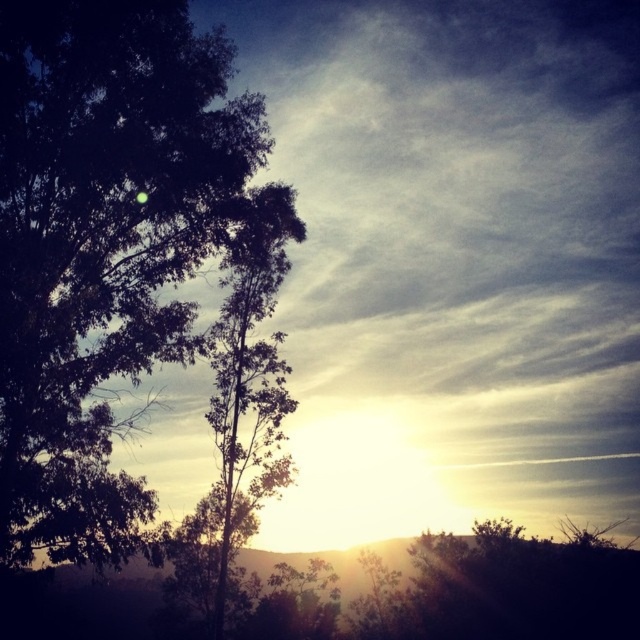
Question: Does dark green leafy tree at left have a larger size compared to green leafy tree at left?

Choices:
 (A) yes
 (B) no

Answer: (A)

Question: Can you confirm if dark green leafy tree at left is positioned above green leafy tree at left?

Choices:
 (A) no
 (B) yes

Answer: (B)

Question: Which point is closer to the camera?

Choices:
 (A) dark green leafy tree at left
 (B) green leafy tree at left

Answer: (A)

Question: Among these objects, which one is farthest from the camera?

Choices:
 (A) dark green leafy tree at left
 (B) green leafy tree at left

Answer: (B)

Question: Among these points, which one is farthest from the camera?

Choices:
 (A) (262, 250)
 (B) (234, 99)

Answer: (A)

Question: Is dark green leafy tree at left in front of green leafy tree at left?

Choices:
 (A) no
 (B) yes

Answer: (B)